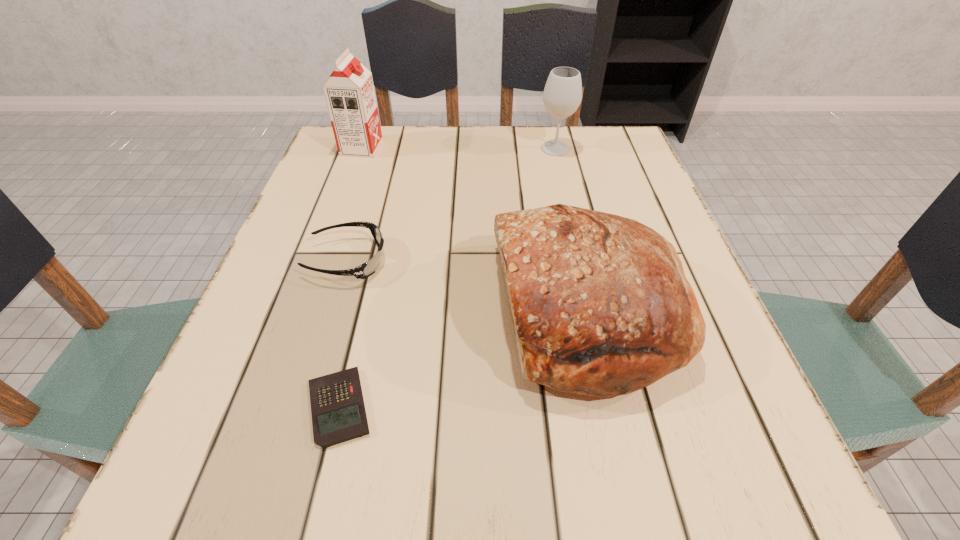
Where is `object that is at the far right corner`? The height and width of the screenshot is (540, 960). object that is at the far right corner is located at coordinates (562, 95).

Where is `free spot at the far edge of the desktop`? This screenshot has height=540, width=960. free spot at the far edge of the desktop is located at coordinates (510, 168).

Identify the location of vacant space at the near edge of the desktop. The width and height of the screenshot is (960, 540). (300, 517).

Locate an element on the screen. Image resolution: width=960 pixels, height=540 pixels. vacant space at the left edge is located at coordinates (284, 415).

The image size is (960, 540). What are the coordinates of `vacant region at the far left corner of the desktop` in the screenshot? It's located at (323, 165).

Identify the location of vacant space at the far right corner of the desktop. The image size is (960, 540). (565, 134).

You are a GUI agent. You are given a task and a screenshot of the screen. Output one action in this format:
    pyautogui.click(x=<x>, y=<y>)
    Task: Click on the blank region between the bread and the second shortest object
    
    Given the screenshot: What is the action you would take?
    pyautogui.click(x=468, y=286)

Find the location of a particular element. The width and height of the screenshot is (960, 540). vacant area that lies between the shortest object and the tallest object is located at coordinates (350, 278).

Where is `vacant space that's between the fourth tallest object and the calculator`? The height and width of the screenshot is (540, 960). vacant space that's between the fourth tallest object and the calculator is located at coordinates (344, 334).

Find the location of `vacant space that is in between the second shortest object and the bread`. vacant space that is in between the second shortest object and the bread is located at coordinates (468, 286).